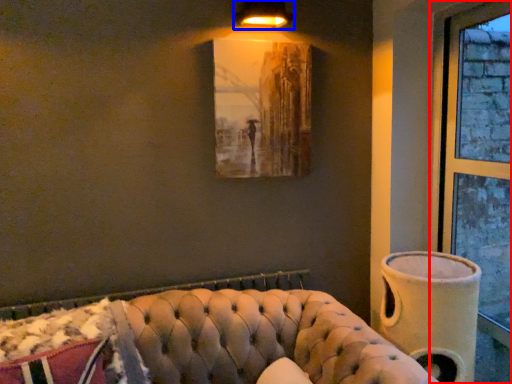
Question: Which object is closer to the camera taking this photo, window (highlighted by a red box) or lamp (highlighted by a blue box)?

Choices:
 (A) window
 (B) lamp

Answer: (A)